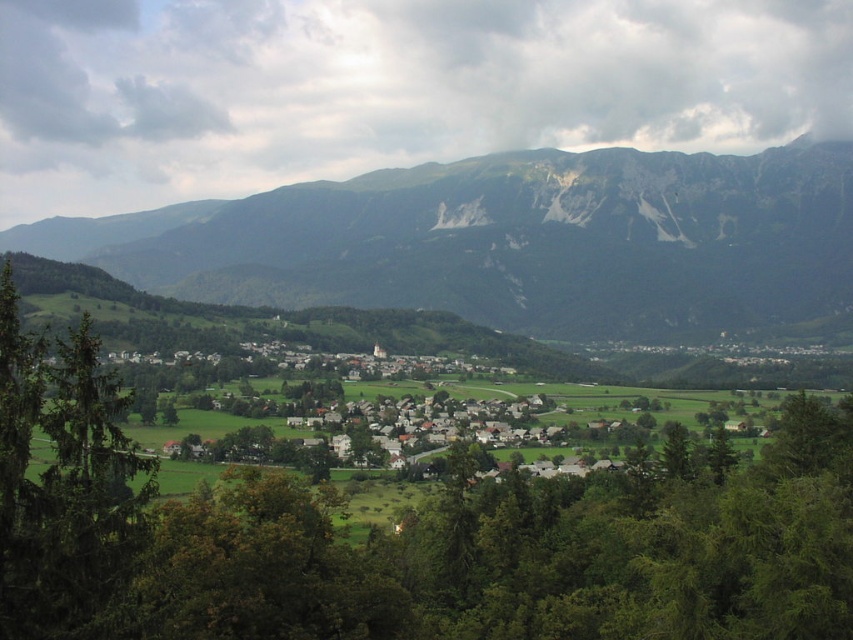
You are standing in the rural landscape and want to take a photo of the green leafy tree at center and the green rocky mountain at upper center. Which object will appear larger in the photo?

The green leafy tree at center will appear larger in the photo because it is closer to the viewer than the green rocky mountain at upper center.

You are standing at the point marked by the coordinate (410, 536) in the image. Looking around, you see a green leafy tree at center. Which direction should you face to see the village buildings with red roofs?

You should face towards the lower area where the village is located, as the village buildings with red roofs are situated in the middle ground below the green leafy tree at center marked by the coordinate.